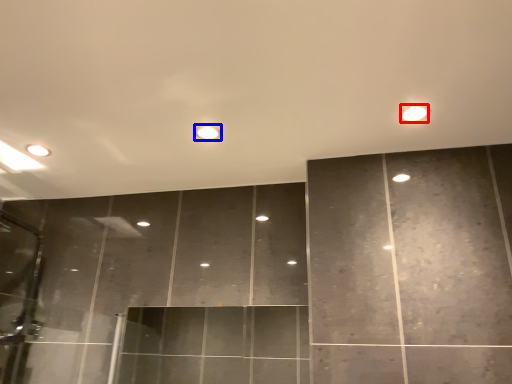
Question: Which of the following is the farthest to the observer, light (highlighted by a red box) or light (highlighted by a blue box)?

Choices:
 (A) light
 (B) light

Answer: (B)